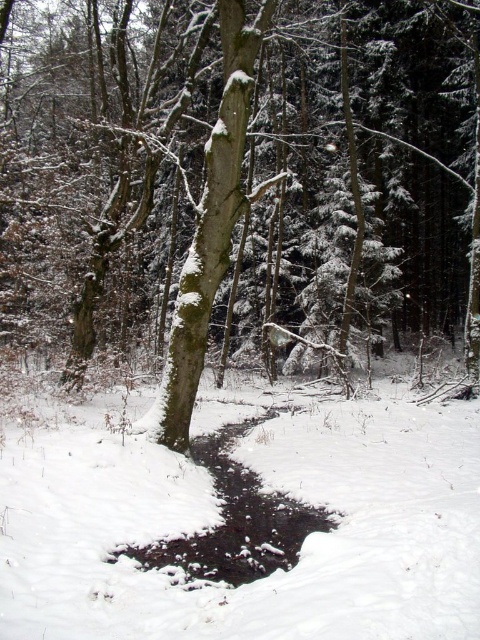
You are an animal trying to cross the stream in the winter scene. You notice the white powdery snow at center and the white textured bark at center. Which surface would provide more stability for your footing?

The white powdery snow at center has a larger size compared to white textured bark at center, so the textured bark would provide more stability for your footing because it has a smaller surface area and better grip.

You are an outdoor photographer carrying a tripod that requires a stable surface. You see the white textured bark at center and the black ice puddle at lower center. Which object would provide a more stable surface for your tripod?

The white textured bark at center would provide a more stable surface for the tripod since it is solid bark, while the black ice puddle at lower center is a liquid puddle and cannot support the tripod.

You are standing at the edge of the stream in the winter forest scene. You want to walk to the point marked as point (222, 522). According to the scene description, what will you find there?

At point (222, 522), you will find white powdery snow at center.